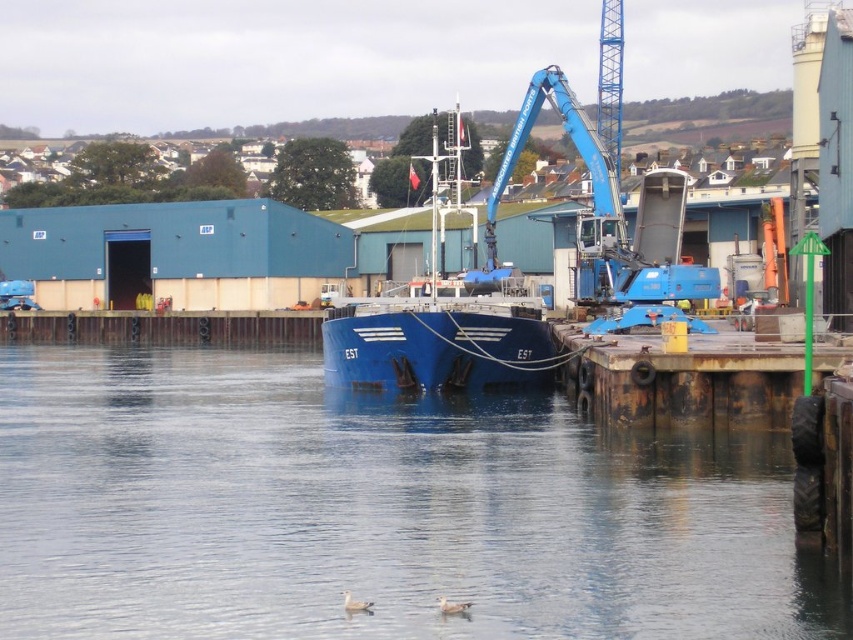
Who is shorter, transparent water at center or white feathered duck at lower center?

white feathered duck at lower center

Is transparent water at center above white feathered duck at lower center?

Yes, transparent water at center is above white feathered duck at lower center.

Between point (318, 548) and point (444, 600), which one is positioned behind?

The point (318, 548) is behind.

I want to click on transparent water at center, so click(375, 509).

Can you confirm if rusty metal dock at lower right is shorter than white matte duck at lower center?

No.

Does rusty metal dock at lower right appear over white matte duck at lower center?

Yes, rusty metal dock at lower right is above white matte duck at lower center.

Measure the distance between rusty metal dock at lower right and camera.

They are 159.90 feet apart.

The width and height of the screenshot is (853, 640). Find the location of `rusty metal dock at lower right`. rusty metal dock at lower right is located at coordinates (682, 380).

This screenshot has height=640, width=853. What are the coordinates of `blue matte boat at center` in the screenshot? It's located at (442, 317).

Can you confirm if blue matte boat at center is wider than white matte duck at lower center?

Indeed, blue matte boat at center has a greater width compared to white matte duck at lower center.

Where is `blue matte boat at center`? blue matte boat at center is located at coordinates (442, 317).

Locate an element on the screen. This screenshot has height=640, width=853. blue matte boat at center is located at coordinates (442, 317).